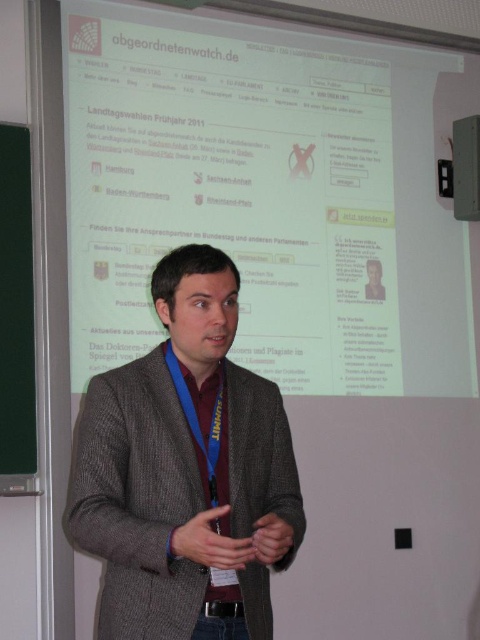
You are a stagehand setting up for an event. You need to position a microphone stand 5 feet away from the gray woolen sweater at center. Can you place it in front of the white glossy projection screen at upper center?

The white glossy projection screen at upper center is 4.91 feet from the gray woolen sweater at center. Since the required distance is 5 feet, placing the microphone stand 4.91 feet away would be slightly closer than needed. Therefore, you cannot place it in front of the white glossy projection screen at upper center and maintain the 5 feet distance.

You are a photographer trying to capture the speaker and the screen clearly in one shot. You notice two points in the image at coordinates point (163, 490) and point (33, 330). Which point is positioned closer to your camera lens?

Point (163, 490) is closer to the viewer than point (33, 330).